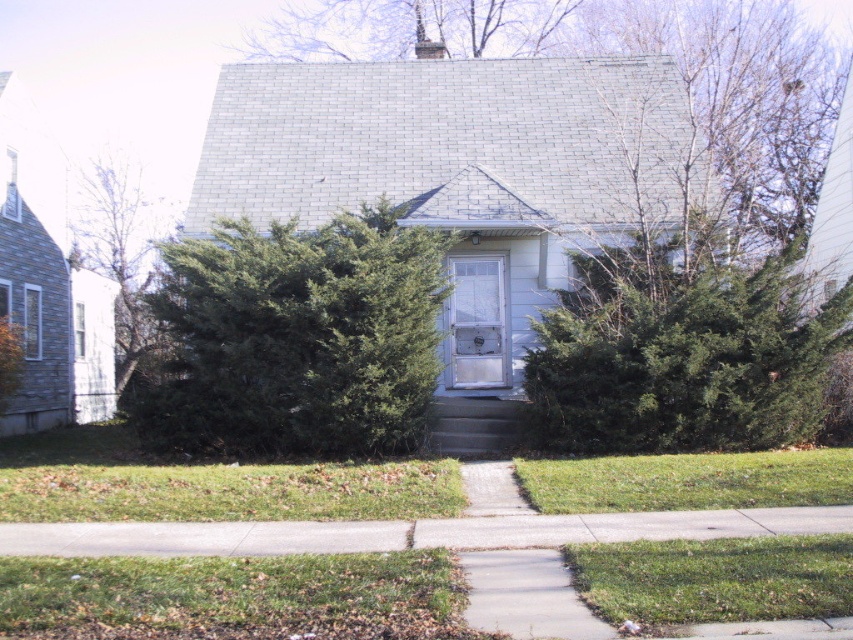
Can you confirm if green textured bush at center is wider than white plastic door at center?

Correct, the width of green textured bush at center exceeds that of white plastic door at center.

Is point (555, 353) in front of point (474, 332)?

Yes, it is.

This screenshot has width=853, height=640. Identify the location of green textured bush at center. (682, 352).

Does green textured bush at center have a smaller size compared to green leafy tree at left?

Correct, green textured bush at center occupies less space than green leafy tree at left.

Is green textured bush at center positioned behind green leafy tree at left?

No, green textured bush at center is closer to the viewer.

I want to click on green textured bush at center, so tap(682, 352).

Is green leafy bush at center shorter than green leafy tree at left?

Yes, green leafy bush at center is shorter than green leafy tree at left.

The width and height of the screenshot is (853, 640). What are the coordinates of `green leafy bush at center` in the screenshot? It's located at (296, 339).